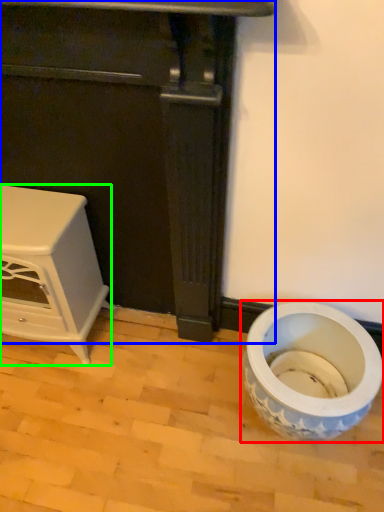
Question: Which object is positioned closest to toilet (highlighted by a red box)? Select from furniture (highlighted by a blue box) and furniture (highlighted by a green box).

Choices:
 (A) furniture
 (B) furniture

Answer: (A)